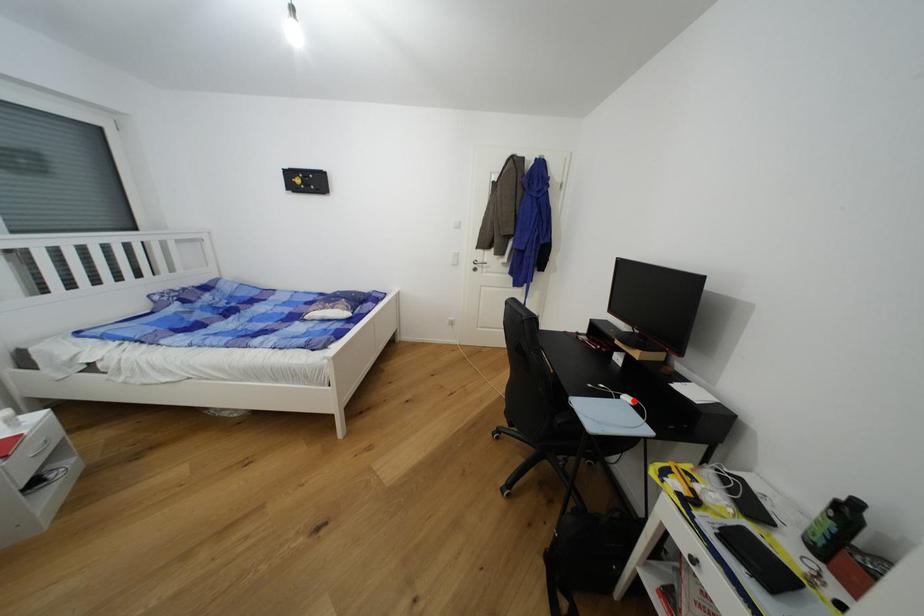
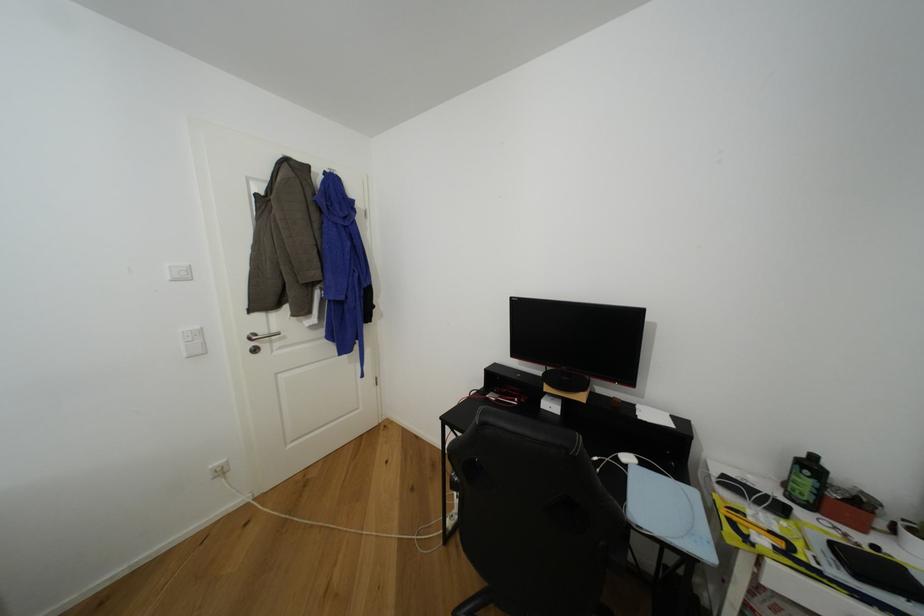
Locate, in the second image, the point that corresponds to the highlighted location in the first image.

(633, 460)